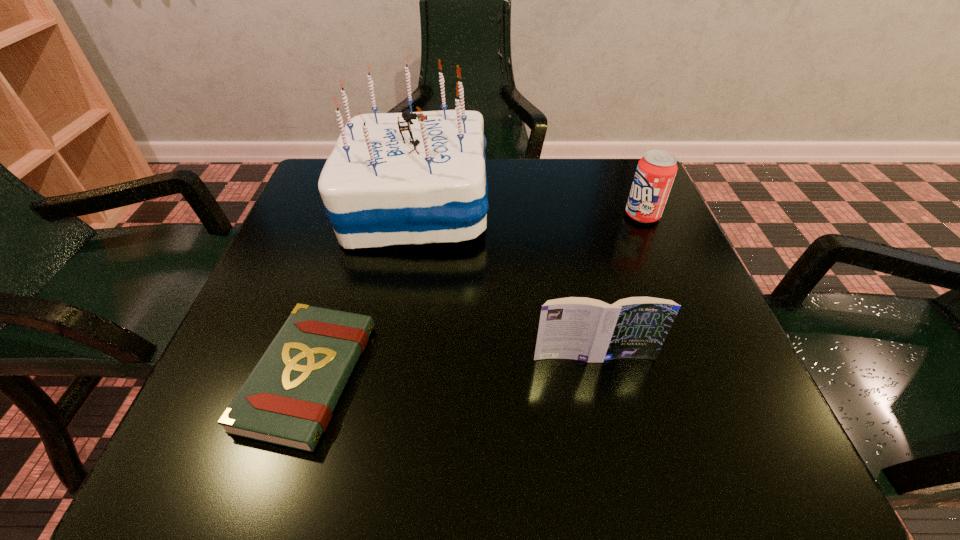
The image size is (960, 540). In order to click on vacant area between the right book and the soda can in this screenshot , I will do `click(618, 286)`.

Find the location of a particular element. The width and height of the screenshot is (960, 540). free space between the shorter book and the right book is located at coordinates (451, 367).

I want to click on vacant area that lies between the rightmost object and the shortest object, so click(x=475, y=296).

Identify the location of vacant point located between the left book and the rightmost object. (475, 296).

What are the coordinates of `vacant area that lies between the rightmost object and the second object from right to left` in the screenshot? It's located at (618, 286).

This screenshot has width=960, height=540. Find the location of `free spot between the tallest object and the rightmost object`. free spot between the tallest object and the rightmost object is located at coordinates (529, 210).

Find the location of `vacant area that lies between the taller book and the soda can`. vacant area that lies between the taller book and the soda can is located at coordinates (618, 286).

Where is `unoccupied area between the taller book and the left book`? The image size is (960, 540). unoccupied area between the taller book and the left book is located at coordinates (451, 367).

Locate an element on the screen. Image resolution: width=960 pixels, height=540 pixels. object that is the second closest to the rightmost object is located at coordinates (579, 328).

Image resolution: width=960 pixels, height=540 pixels. I want to click on object that stands as the third closest to the tallest object, so click(x=656, y=170).